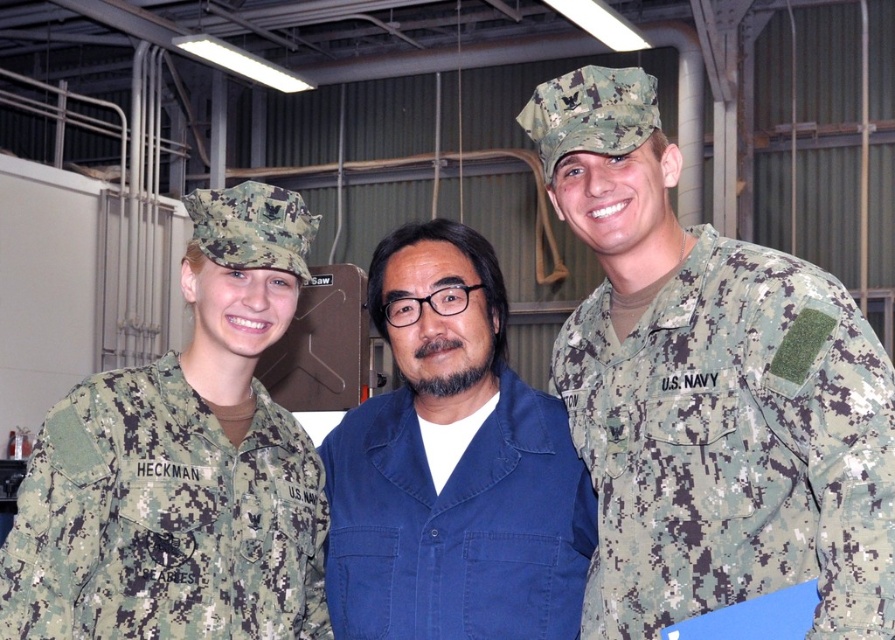
You are a photographer setting up for a group photo. You need to position the digital camouflage uniform at left and the blue cotton shirt at center so that both are visible in the frame. Given their height difference, which person should stand closer to the camera to ensure their faces are equally visible?

The blue cotton shirt at center should stand closer to the camera since the digital camouflage uniform at left is taller than blue cotton shirt at center. This adjustment will help balance their visibility in the photo.

You are a photographer setting up a group photo for three people. The subjects are wearing the digital camouflage uniform at left and the blue cotton shirt at center. You want to ensure everyone is framed properly. Considering the size of their uniforms, which subject should you position closer to the camera to maintain proportional balance in the photo?

The blue cotton shirt at center should be positioned closer to the camera because the digital camouflage uniform at left is bigger than the blue cotton shirt at center, so moving the smaller one forward helps balance their sizes in the frame.

In the scene described, there are two U.S. Navy personnel and one individual in a blue work uniform. The digital camouflage uniform at right is located at point (732, 444). Where would you find the individual wearing the digital camouflage uniform at right?

The digital camouflage uniform at right is located at point (732, 444).